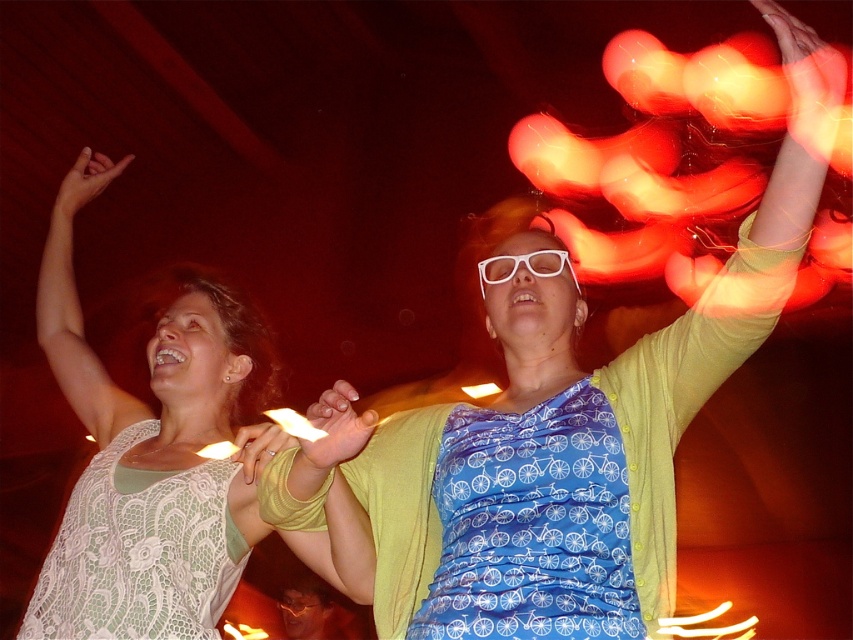
Question: Is smooth red hand at upper right positioned behind white plastic goggles at upper center?

Choices:
 (A) no
 (B) yes

Answer: (A)

Question: In this image, where is white lace arm at upper left located relative to smooth yellow hand at center?

Choices:
 (A) left
 (B) right

Answer: (A)

Question: Does matte white hand at upper left appear on the left side of smooth red hand at upper right?

Choices:
 (A) no
 (B) yes

Answer: (B)

Question: Which point is farther to the camera?

Choices:
 (A) (258, 472)
 (B) (495, 612)
 (C) (759, 8)

Answer: (A)

Question: Among these points, which one is nearest to the camera?

Choices:
 (A) (254, 522)
 (B) (70, 392)
 (C) (480, 285)
 (D) (370, 433)

Answer: (D)

Question: Which of the following is the closest to the observer?

Choices:
 (A) (349, 445)
 (B) (759, 1)

Answer: (B)